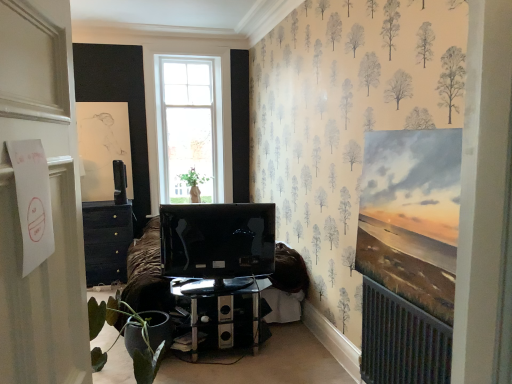
Question: Can you confirm if green matte plant at lower left is smaller than satin black television at upper left, which is counted as the first television, starting from the left?

Choices:
 (A) no
 (B) yes

Answer: (A)

Question: Is green matte plant at lower left taller than satin black television at upper left, positioned as the 1th television in back-to-front order?

Choices:
 (A) no
 (B) yes

Answer: (B)

Question: Is satin black television at upper left, the 1th television from the top, inside green matte plant at lower left?

Choices:
 (A) no
 (B) yes

Answer: (A)

Question: Does green matte plant at lower left lie in front of satin black television at upper left, marked as the 2th television in a front-to-back arrangement?

Choices:
 (A) yes
 (B) no

Answer: (A)

Question: From a real-world perspective, is green matte plant at lower left positioned under satin black television at upper left, which appears as the second television when ordered from the bottom, based on gravity?

Choices:
 (A) no
 (B) yes

Answer: (B)

Question: Are green matte plant at lower left and satin black television at upper left, which is counted as the first television, starting from the left, far apart?

Choices:
 (A) yes
 (B) no

Answer: (A)

Question: Is satin black television at upper left, marked as the 2th television in a front-to-back arrangement, in front of green matte vase at center?

Choices:
 (A) yes
 (B) no

Answer: (A)

Question: Would you say satin black television at upper left, the 1th television from the top, is outside green matte vase at center?

Choices:
 (A) no
 (B) yes

Answer: (B)

Question: Is satin black television at upper left, marked as the 2th television in a front-to-back arrangement, to the left of green matte vase at center from the viewer's perspective?

Choices:
 (A) no
 (B) yes

Answer: (B)

Question: Is satin black television at upper left, marked as the 2th television in a front-to-back arrangement, wider than green matte vase at center?

Choices:
 (A) no
 (B) yes

Answer: (A)

Question: From a real-world perspective, is satin black television at upper left, positioned as the 1th television in back-to-front order, on green matte vase at center?

Choices:
 (A) yes
 (B) no

Answer: (A)

Question: From the image's perspective, is matte black tv at center, arranged as the first television when ordered from the bottom, on green matte plant at lower left?

Choices:
 (A) no
 (B) yes

Answer: (B)